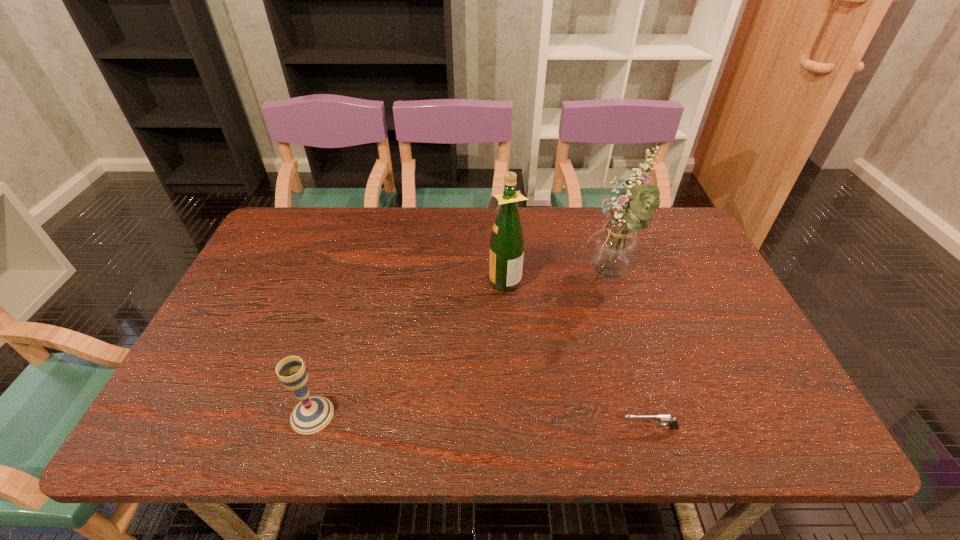
The width and height of the screenshot is (960, 540). In order to click on free spot between the third object from right to left and the bouquet in this screenshot , I will do `click(557, 279)`.

Where is `vacant area between the second shortest object and the pistol`? Image resolution: width=960 pixels, height=540 pixels. vacant area between the second shortest object and the pistol is located at coordinates (481, 421).

At what (x,y) coordinates should I click in order to perform the action: click on vacant space that's between the leftmost object and the pistol. Please return your answer as a coordinate pair (x, y). This screenshot has height=540, width=960. Looking at the image, I should click on (481, 421).

Where is `empty space between the chalice and the pistol`? empty space between the chalice and the pistol is located at coordinates (481, 421).

Point out which object is positioned as the third nearest to the liquor. Please provide its 2D coordinates. Your answer should be formatted as a tuple, i.e. [(x, y)], where the tuple contains the x and y coordinates of a point satisfying the conditions above.

[(312, 414)]

Find the location of a particular element. the closest object relative to the bouquet is located at coordinates (507, 240).

This screenshot has height=540, width=960. Identify the location of vacant space that satisfies the following two spatial constraints: 1. on the front-facing side of the liquor; 2. on the front side of the leftmost object. (511, 415).

The width and height of the screenshot is (960, 540). In order to click on free space in the image that satisfies the following two spatial constraints: 1. on the front-facing side of the liquor; 2. on the front side of the third tallest object in this screenshot , I will do `click(511, 415)`.

The image size is (960, 540). What are the coordinates of `free spot that satisfies the following two spatial constraints: 1. on the front-facing side of the third object from right to left; 2. on the front side of the leftmost object` in the screenshot? It's located at (511, 415).